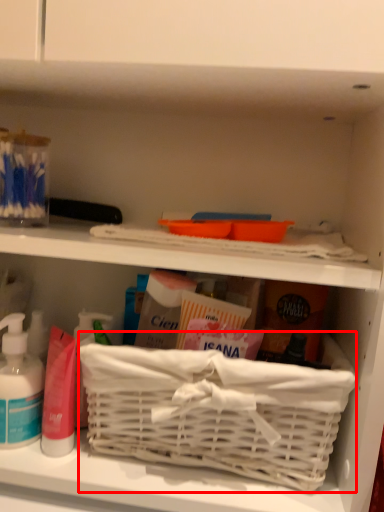
Question: Observing the image, what is the correct spatial positioning of basket container (annotated by the red box) in reference to cleaning product?

Choices:
 (A) right
 (B) left

Answer: (A)